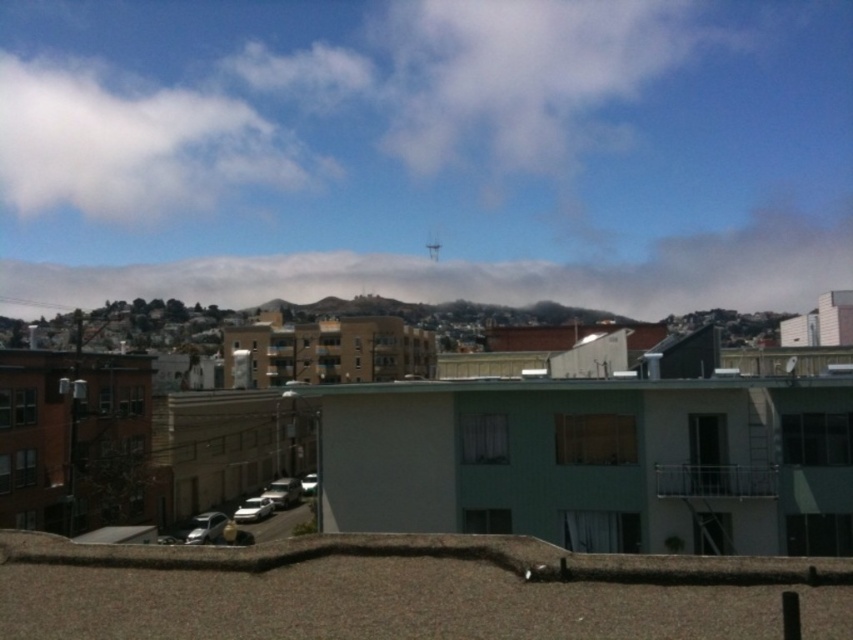
Can you confirm if white fluffy cloud at upper center is wider than white fluffy cloud at upper left?

Correct, the width of white fluffy cloud at upper center exceeds that of white fluffy cloud at upper left.

Is point (759, 230) positioned in front of point (251, 173)?

No, it is not.

Locate an element on the screen. This screenshot has height=640, width=853. white fluffy cloud at upper center is located at coordinates (480, 275).